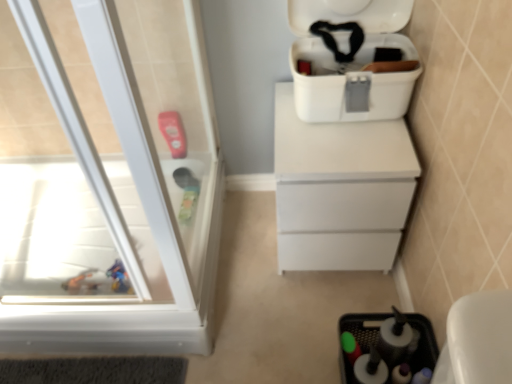
Locate an element on the screen. This screenshot has height=384, width=512. vacant space situated above black plastic sink at lower right (from a real-world perspective) is located at coordinates (377, 335).